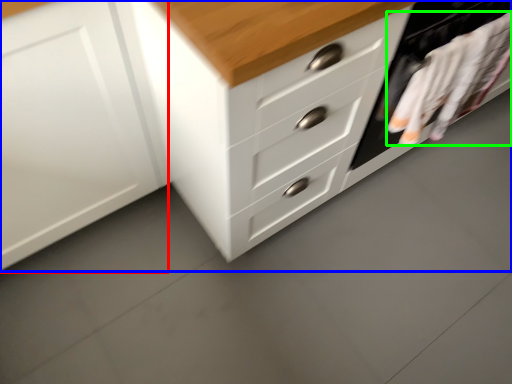
Question: Considering the real-world distances, which object is closest to cabinetry (highlighted by a red box)? chest of drawers (highlighted by a blue box) or laundry (highlighted by a green box).

Choices:
 (A) chest of drawers
 (B) laundry

Answer: (A)